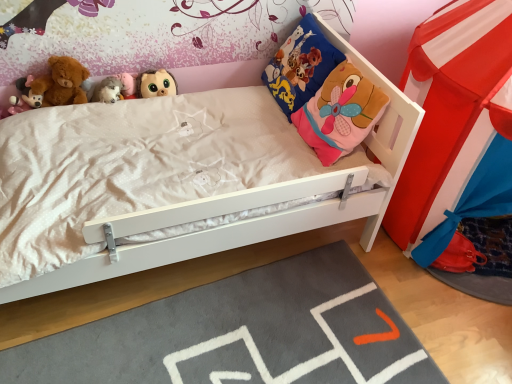
What do you see at coordinates (300, 66) in the screenshot?
I see `blue fabric pillow at upper right` at bounding box center [300, 66].

What is the approximate width of soft plush teddy bear at upper left?

→ soft plush teddy bear at upper left is 4.40 inches wide.

Where is `gray soft rug at lower center`? gray soft rug at lower center is located at coordinates tap(243, 333).

Describe the element at coordinates (24, 97) in the screenshot. Image resolution: width=512 pixels, height=384 pixels. I see `matte pink plush toy at upper left, the first toy when ordered from left to right` at that location.

Describe the element at coordinates (106, 90) in the screenshot. The image size is (512, 384). I see `white plush toy at upper left, positioned as the 2th toy in right-to-left order` at that location.

You are a GUI agent. You are given a task and a screenshot of the screen. Output one action in this format:
    pyautogui.click(x=<x>, y=<y>)
    Task: Click on the white plush toy at upper left, positioned as the 2th toy in right-to-left order
    This screenshot has height=384, width=512.
    Given the screenshot: What is the action you would take?
    pyautogui.click(x=106, y=90)

This screenshot has height=384, width=512. Identify the location of matte brown plush toy at upper center, placed as the third toy when sorted from left to right. (156, 84).

Identify the location of blue fabric pillow at upper right. Image resolution: width=512 pixels, height=384 pixels. (300, 66).

Looking at this image, is soft plush teddy bear at upper left with gray soft rug at lower center?

No.

Considering the sizes of objects soft plush teddy bear at upper left and gray soft rug at lower center in the image provided, who is smaller, soft plush teddy bear at upper left or gray soft rug at lower center?

Smaller between the two is soft plush teddy bear at upper left.

Identify the location of doll positioned vertically above the gray soft rug at lower center (from a real-world perspective). (62, 82).

Is point (59, 88) positioned before point (218, 300)?

No, it is behind (218, 300).

Can we say soft plush teddy bear at upper left lies outside matte brown plush toy at upper center, which is the 1th toy in right-to-left order?

soft plush teddy bear at upper left is positioned outside matte brown plush toy at upper center, which is the 1th toy in right-to-left order.

From the picture: From the image's perspective, is soft plush teddy bear at upper left positioned above or below matte brown plush toy at upper center, placed as the third toy when sorted from left to right?

From the image's perspective, soft plush teddy bear at upper left appears below matte brown plush toy at upper center, placed as the third toy when sorted from left to right.

Is soft plush teddy bear at upper left looking in the opposite direction of matte brown plush toy at upper center, placed as the third toy when sorted from left to right?

No.

From a real-world perspective, is soft plush teddy bear at upper left physically above matte brown plush toy at upper center, which is the 1th toy in right-to-left order?

Yes.

Is point (18, 111) positioned behind point (106, 83)?

That is False.

From a real-world perspective, is matte pink plush toy at upper left, marked as the third toy in a right-to-left arrangement, under white plush toy at upper left, marked as the 2th toy in a left-to-right arrangement?

Incorrect, from a real-world perspective, matte pink plush toy at upper left, marked as the third toy in a right-to-left arrangement, is higher than white plush toy at upper left, marked as the 2th toy in a left-to-right arrangement.

Would you say matte pink plush toy at upper left, the first toy when ordered from left to right, is outside white plush toy at upper left, positioned as the 2th toy in right-to-left order?

That's correct, matte pink plush toy at upper left, the first toy when ordered from left to right, is outside of white plush toy at upper left, positioned as the 2th toy in right-to-left order.

Is matte pink plush toy at upper left, the first toy when ordered from left to right, touching white plush toy at upper left, positioned as the 2th toy in right-to-left order?

No, matte pink plush toy at upper left, the first toy when ordered from left to right, is not touching white plush toy at upper left, positioned as the 2th toy in right-to-left order.

From a real-world perspective, which object rests below the other?

From a 3D spatial view, gray soft rug at lower center is below.

Considering the relative sizes of gray soft rug at lower center and soft plush teddy bear at upper left in the image provided, is gray soft rug at lower center thinner than soft plush teddy bear at upper left?

No.

Is gray soft rug at lower center smaller than soft plush teddy bear at upper left?

No, gray soft rug at lower center is not smaller than soft plush teddy bear at upper left.

How many degrees apart are the facing directions of gray soft rug at lower center and soft plush teddy bear at upper left?

The angle between the facing direction of gray soft rug at lower center and the facing direction of soft plush teddy bear at upper left is 5.01 degrees.

Does matte pink plush toy at upper left, marked as the third toy in a right-to-left arrangement, come in front of soft plush teddy bear at upper left?

Yes, the depth of matte pink plush toy at upper left, marked as the third toy in a right-to-left arrangement, is less than that of soft plush teddy bear at upper left.

Considering the sizes of objects matte pink plush toy at upper left, the first toy when ordered from left to right, and soft plush teddy bear at upper left in the image provided, who is bigger, matte pink plush toy at upper left, the first toy when ordered from left to right, or soft plush teddy bear at upper left?

soft plush teddy bear at upper left is bigger.

Is point (17, 86) closer to camera compared to point (62, 68)?

That is True.

Considering the relative sizes of matte pink plush toy at upper left, the first toy when ordered from left to right, and soft plush teddy bear at upper left in the image provided, is matte pink plush toy at upper left, the first toy when ordered from left to right, wider than soft plush teddy bear at upper left?

In fact, matte pink plush toy at upper left, the first toy when ordered from left to right, might be narrower than soft plush teddy bear at upper left.

Can you confirm if matte brown plush toy at upper center, which is the 1th toy in right-to-left order, is wider than white plush toy at upper left, marked as the 2th toy in a left-to-right arrangement?

No.

From the image's perspective, is matte brown plush toy at upper center, placed as the third toy when sorted from left to right, above white plush toy at upper left, marked as the 2th toy in a left-to-right arrangement?

Yes.

Could you tell me if matte brown plush toy at upper center, placed as the third toy when sorted from left to right, is facing white plush toy at upper left, marked as the 2th toy in a left-to-right arrangement?

No.

Would you say matte brown plush toy at upper center, placed as the third toy when sorted from left to right, is a long distance from white plush toy at upper left, marked as the 2th toy in a left-to-right arrangement?

No.

Image resolution: width=512 pixels, height=384 pixels. Identify the location of toy that is on the right side of white plush toy at upper left, positioned as the 2th toy in right-to-left order. (156, 84).

Considering the relative sizes of white plush toy at upper left, marked as the 2th toy in a left-to-right arrangement, and matte brown plush toy at upper center, which is the 1th toy in right-to-left order, in the image provided, is white plush toy at upper left, marked as the 2th toy in a left-to-right arrangement, smaller than matte brown plush toy at upper center, which is the 1th toy in right-to-left order,?

Indeed, white plush toy at upper left, marked as the 2th toy in a left-to-right arrangement, has a smaller size compared to matte brown plush toy at upper center, which is the 1th toy in right-to-left order.

Which of these two, white plush toy at upper left, positioned as the 2th toy in right-to-left order, or matte brown plush toy at upper center, placed as the third toy when sorted from left to right, is wider?

white plush toy at upper left, positioned as the 2th toy in right-to-left order, is wider.

Looking at this image, could you tell me if white plush toy at upper left, marked as the 2th toy in a left-to-right arrangement, is turned towards matte brown plush toy at upper center, placed as the third toy when sorted from left to right?

No, white plush toy at upper left, marked as the 2th toy in a left-to-right arrangement, is not aimed at matte brown plush toy at upper center, placed as the third toy when sorted from left to right.

Image resolution: width=512 pixels, height=384 pixels. I want to click on plain on the right side of soft plush teddy bear at upper left, so click(243, 333).

Where is `doll below the matte brown plush toy at upper center, which is the 1th toy in right-to-left order (from the image's perspective)`? The height and width of the screenshot is (384, 512). doll below the matte brown plush toy at upper center, which is the 1th toy in right-to-left order (from the image's perspective) is located at coordinates (62, 82).

From the image, which object appears to be farther from matte brown plush toy at upper center, which is the 1th toy in right-to-left order, white plush toy at upper left, positioned as the 2th toy in right-to-left order, or gray soft rug at lower center?

gray soft rug at lower center is further to matte brown plush toy at upper center, which is the 1th toy in right-to-left order.

Which object lies further to the anchor point matte brown plush toy at upper center, placed as the third toy when sorted from left to right, matte pink plush toy at upper left, the first toy when ordered from left to right, or soft plush teddy bear at upper left?

matte pink plush toy at upper left, the first toy when ordered from left to right, is positioned further to the anchor matte brown plush toy at upper center, placed as the third toy when sorted from left to right.

From the image, which object appears to be farther from soft plush teddy bear at upper left, gray soft rug at lower center or matte pink plush toy at upper left, the first toy when ordered from left to right?

The object further to soft plush teddy bear at upper left is gray soft rug at lower center.

Looking at the image, which one is located closer to white plush toy at upper left, positioned as the 2th toy in right-to-left order, matte brown plush toy at upper center, which is the 1th toy in right-to-left order, or matte pink plush toy at upper left, the first toy when ordered from left to right?

Among the two, matte brown plush toy at upper center, which is the 1th toy in right-to-left order, is located nearer to white plush toy at upper left, positioned as the 2th toy in right-to-left order.

Which object lies further to the anchor point matte pink plush toy at upper left, marked as the third toy in a right-to-left arrangement, white plush toy at upper left, marked as the 2th toy in a left-to-right arrangement, or matte brown plush toy at upper center, which is the 1th toy in right-to-left order?

The object further to matte pink plush toy at upper left, marked as the third toy in a right-to-left arrangement, is matte brown plush toy at upper center, which is the 1th toy in right-to-left order.

Which object lies further to the anchor point matte brown plush toy at upper center, which is the 1th toy in right-to-left order, gray soft rug at lower center or blue fabric pillow at upper right?

gray soft rug at lower center is further to matte brown plush toy at upper center, which is the 1th toy in right-to-left order.

From the image, which object appears to be farther from blue fabric pillow at upper right, soft plush teddy bear at upper left or matte pink plush toy at upper left, marked as the third toy in a right-to-left arrangement?

matte pink plush toy at upper left, marked as the third toy in a right-to-left arrangement, is further to blue fabric pillow at upper right.

Considering their positions, is blue fabric pillow at upper right positioned closer to white plush toy at upper left, marked as the 2th toy in a left-to-right arrangement, than matte brown plush toy at upper center, placed as the third toy when sorted from left to right?

Among the two, matte brown plush toy at upper center, placed as the third toy when sorted from left to right, is located nearer to white plush toy at upper left, marked as the 2th toy in a left-to-right arrangement.

Where is `doll between matte brown plush toy at upper center, which is the 1th toy in right-to-left order, and gray soft rug at lower center in the up-down direction`? This screenshot has width=512, height=384. doll between matte brown plush toy at upper center, which is the 1th toy in right-to-left order, and gray soft rug at lower center in the up-down direction is located at coordinates (62, 82).

Find the location of a particular element. This screenshot has width=512, height=384. doll between matte pink plush toy at upper left, the first toy when ordered from left to right, and white plush toy at upper left, positioned as the 2th toy in right-to-left order is located at coordinates (62, 82).

Where is `doll between matte pink plush toy at upper left, marked as the third toy in a right-to-left arrangement, and matte brown plush toy at upper center, which is the 1th toy in right-to-left order`? Image resolution: width=512 pixels, height=384 pixels. doll between matte pink plush toy at upper left, marked as the third toy in a right-to-left arrangement, and matte brown plush toy at upper center, which is the 1th toy in right-to-left order is located at coordinates (62, 82).

Image resolution: width=512 pixels, height=384 pixels. I want to click on doll between blue fabric pillow at upper right and gray soft rug at lower center in the up-down direction, so click(x=62, y=82).